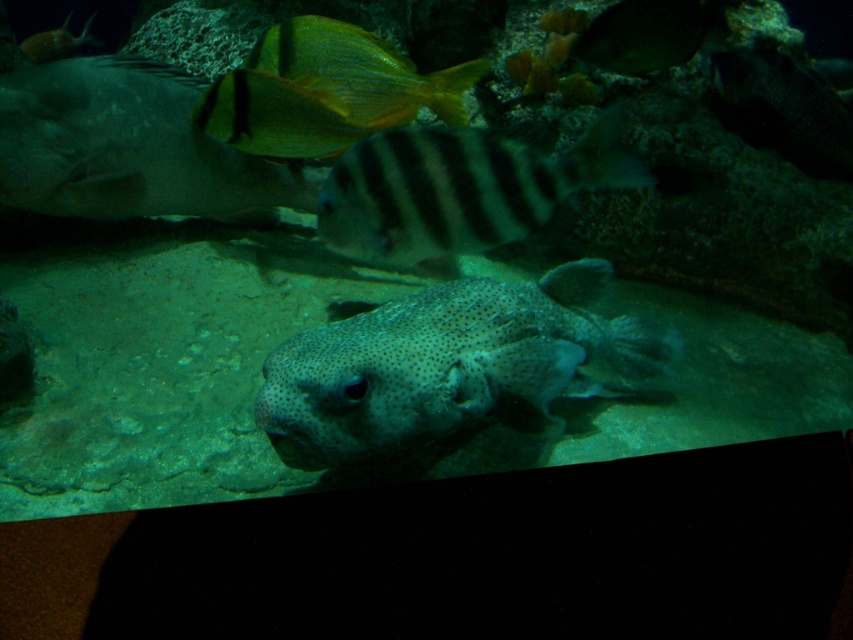
Question: Does dark gray striped fish at center have a lesser width compared to dark textured fish at upper right?

Choices:
 (A) yes
 (B) no

Answer: (B)

Question: Does spotted matte pufferfish at center have a larger size compared to yellow shiny fish at upper center?

Choices:
 (A) yes
 (B) no

Answer: (A)

Question: Which of these objects is positioned farthest from the yellow shiny fish at upper center?

Choices:
 (A) dark gray striped fish at center
 (B) yellow-green striped fish at upper center
 (C) smooth gray shark at upper left

Answer: (C)

Question: Which of the following is the farthest from the observer?

Choices:
 (A) (804, 115)
 (B) (137, 61)

Answer: (A)

Question: Among these objects, which one is nearest to the camera?

Choices:
 (A) yellow-green striped fish at upper center
 (B) yellow shiny fish at upper center
 (C) shiny silver fish at upper right
 (D) spotted matte pufferfish at center

Answer: (D)

Question: Does smooth gray shark at upper left come behind smooth brown snail at upper left?

Choices:
 (A) no
 (B) yes

Answer: (A)